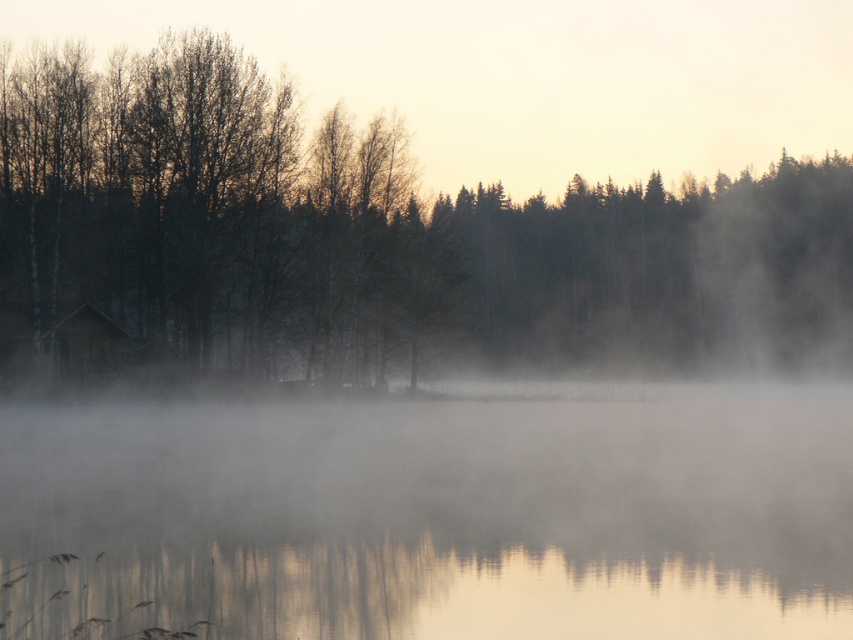
Is transparent misty water at center to the left of silhouette bark tree at left from the viewer's perspective?

Yes, transparent misty water at center is to the left of silhouette bark tree at left.

Can you confirm if transparent misty water at center is wider than silhouette bark tree at left?

No, transparent misty water at center is not wider than silhouette bark tree at left.

Identify the location of transparent misty water at center. This screenshot has width=853, height=640. (442, 515).